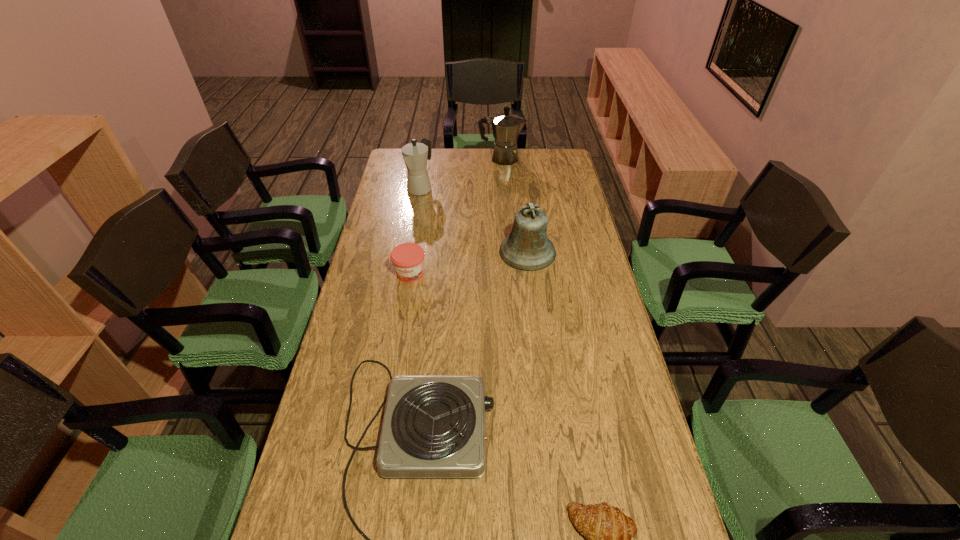
The image size is (960, 540). In order to click on object that is at the far edge in this screenshot , I will do `click(506, 127)`.

Find the location of a particular element. The image size is (960, 540). coffeepot at the left edge is located at coordinates (415, 155).

Identify the location of jam positioned at the left edge. (408, 258).

Identify the location of object at the right edge. (527, 248).

In the image, there is a desktop. In order to click on free region at the far edge in this screenshot , I will do `click(427, 161)`.

I want to click on vacant region at the left edge, so click(x=343, y=338).

The width and height of the screenshot is (960, 540). Find the location of `vacant space at the right edge of the desktop`. vacant space at the right edge of the desktop is located at coordinates [646, 534].

At what (x,y) coordinates should I click in order to perform the action: click on free space at the far right corner of the desktop. Please return your answer as a coordinate pair (x, y). The image size is (960, 540). Looking at the image, I should click on (561, 170).

The image size is (960, 540). What are the coordinates of `free space between the right coffeepot and the left coffeepot` in the screenshot? It's located at (461, 173).

You are a GUI agent. You are given a task and a screenshot of the screen. Output one action in this format:
    pyautogui.click(x=<x>, y=<y>)
    Task: Click on the vacant area that lies between the farthest object and the fourth tallest object
    
    Given the screenshot: What is the action you would take?
    pyautogui.click(x=456, y=216)